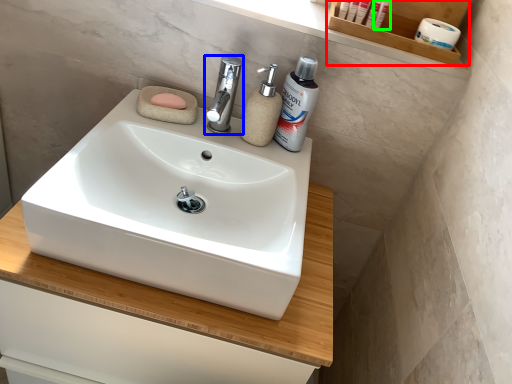
Question: Which object is the closest to the shelf (highlighted by a red box)? Choose among these: tap (highlighted by a blue box) or cosmetic (highlighted by a green box).

Choices:
 (A) tap
 (B) cosmetic

Answer: (B)